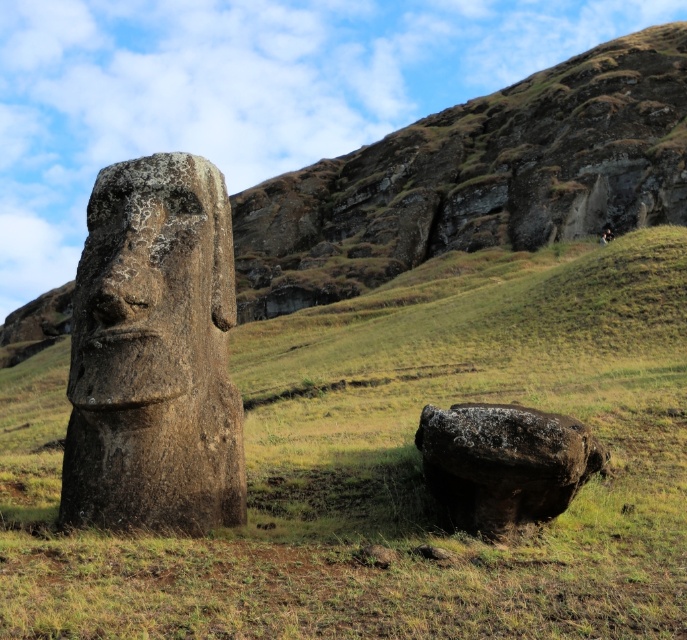
Question: Does green grassy at center come in front of rusty stone boulder at lower right?

Choices:
 (A) no
 (B) yes

Answer: (B)

Question: Which point appears closest to the camera in this image?

Choices:
 (A) (556, 458)
 (B) (74, 292)

Answer: (A)

Question: Does green grassy at center appear on the left side of rusty stone boulder at lower right?

Choices:
 (A) yes
 (B) no

Answer: (A)

Question: Which point appears closest to the camera in this image?

Choices:
 (A) (146, 237)
 (B) (304, 308)

Answer: (A)

Question: Does green grassy at center have a smaller size compared to rusty stone boulder at lower right?

Choices:
 (A) yes
 (B) no

Answer: (B)

Question: Which of the following is the closest to the observer?

Choices:
 (A) green grassy at center
 (B) rough stone head at center
 (C) rusty stone boulder at lower right

Answer: (A)